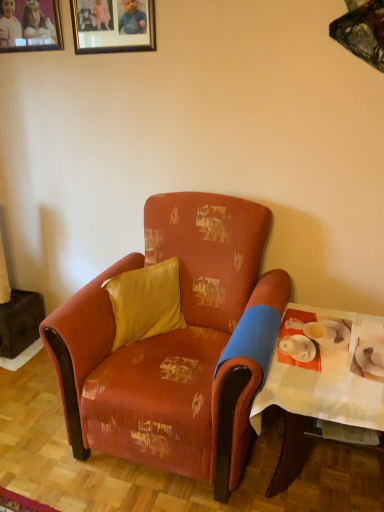
Find the location of `free area below white paper table at right (from a real-world perspective)`. free area below white paper table at right (from a real-world perspective) is located at coordinates (323, 483).